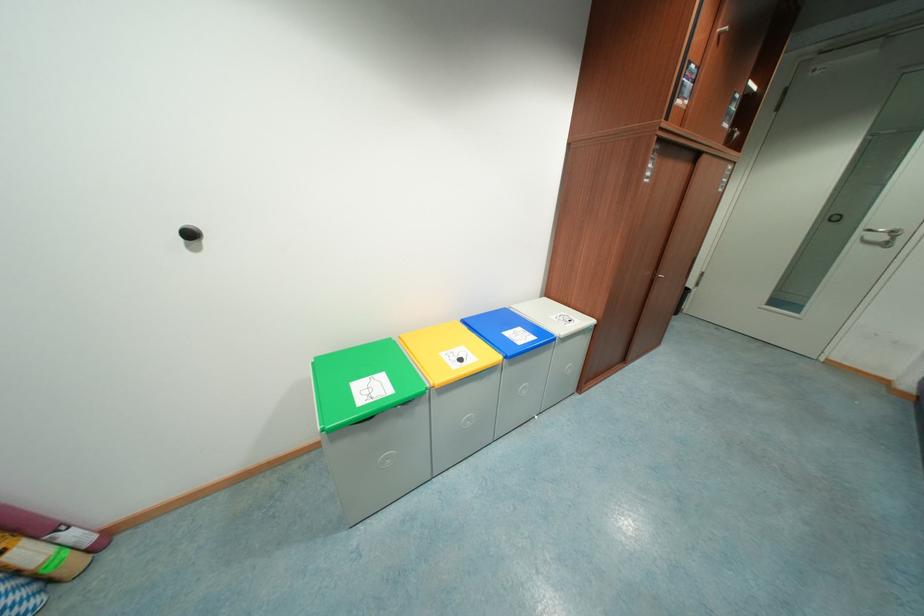
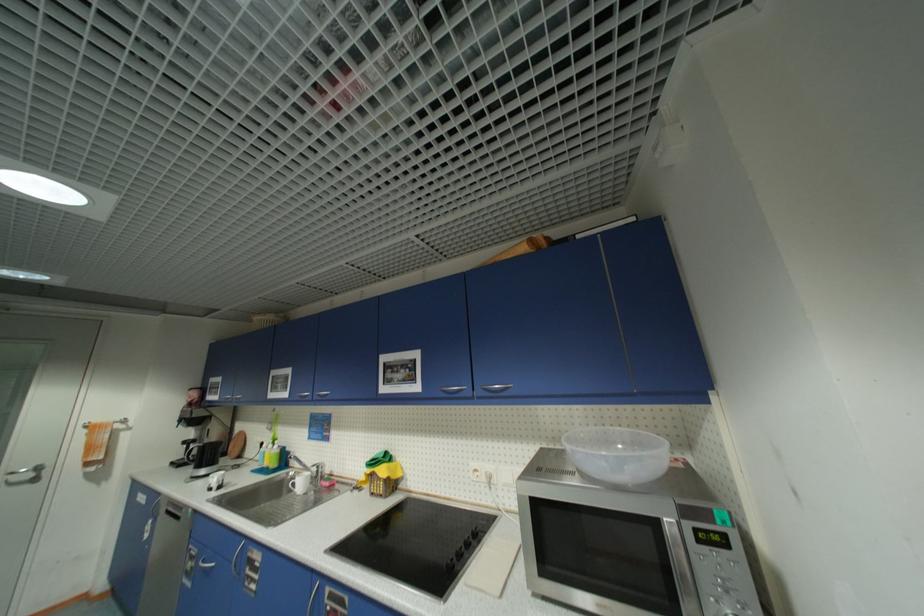
Where in the second image is the point corresponding to (x=864, y=235) from the first image?

(7, 479)